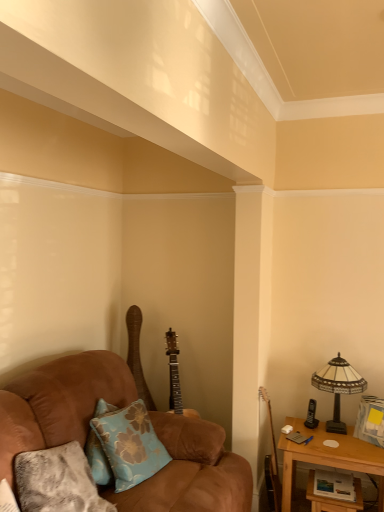
Question: Considering their positions, is brown suede couch at left located in front of or behind stained glass lampshade at right?

Choices:
 (A) front
 (B) behind

Answer: (A)

Question: From the image's perspective, is brown suede couch at left positioned above or below stained glass lampshade at right?

Choices:
 (A) above
 (B) below

Answer: (B)

Question: Which object is the farthest from the stained glass lampshade at right?

Choices:
 (A) brown suede couch at left
 (B) wooden table at lower right, placed as the 2th table when sorted from right to left
 (C) blue floral fabric pillow at lower left, which is the 1th pillow in back-to-front order
 (D) wooden table at lower right, positioned as the second table in left-to-right order
 (E) textured gray pillow at lower left, which is the second pillow in back-to-front order

Answer: (E)

Question: Considering the real-world distances, which object is closest to the wooden table at lower right, which is the 1th table from right to left?

Choices:
 (A) blue floral fabric pillow at lower left, the 2th pillow when ordered from front to back
 (B) wooden acoustic guitar at right, which ranks as the second guitar in back-to-front order
 (C) brown suede couch at left
 (D) wooden table at lower right, marked as the first table in a left-to-right arrangement
 (E) textured gray pillow at lower left, which is the second pillow in back-to-front order

Answer: (D)